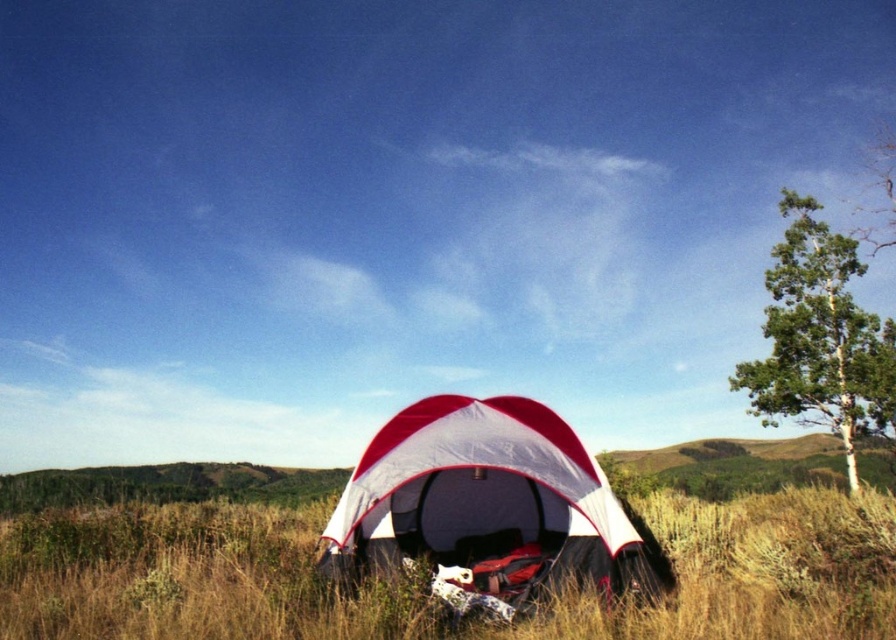
Question: Which point is closer to the camera?

Choices:
 (A) grassy field at center
 (B) green smooth bark tree at right
 (C) white/red fabric tent at center

Answer: (A)

Question: Which of the following is the closest to the observer?

Choices:
 (A) white/red fabric tent at center
 (B) green smooth bark tree at right

Answer: (A)

Question: Estimate the real-world distances between objects in this image. Which object is closer to the green smooth bark tree at right?

Choices:
 (A) grassy field at center
 (B) white/red fabric tent at center

Answer: (A)

Question: Is grassy field at center thinner than white/red fabric tent at center?

Choices:
 (A) no
 (B) yes

Answer: (A)

Question: Can you confirm if grassy field at center is positioned to the left of green smooth bark tree at right?

Choices:
 (A) no
 (B) yes

Answer: (B)

Question: Is grassy field at center behind white/red fabric tent at center?

Choices:
 (A) no
 (B) yes

Answer: (A)